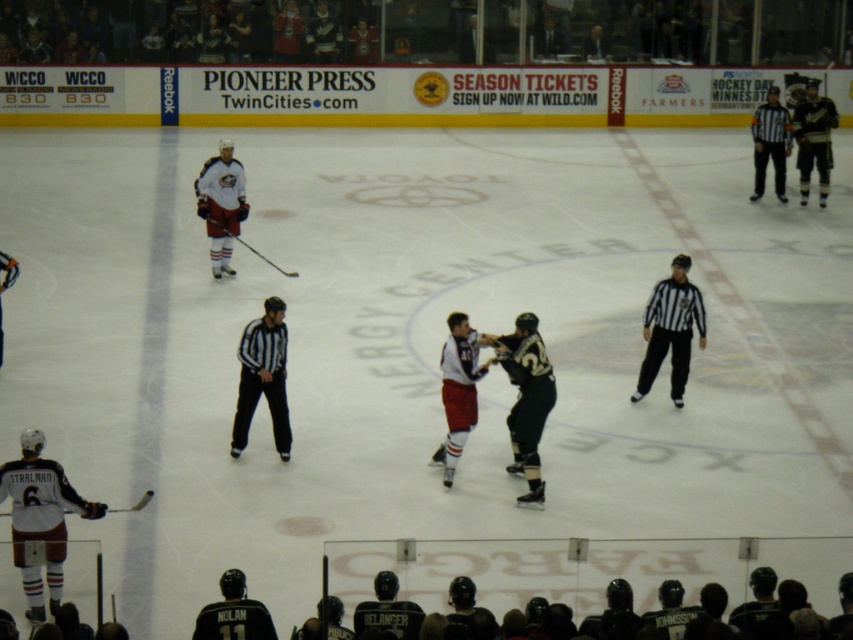
Does striped jersey official at center appear on the right side of white jersey at center?

Indeed, striped jersey official at center is positioned on the right side of white jersey at center.

Consider the image. Can you confirm if striped jersey official at center is wider than white jersey at center?

Yes.

Does point (688, 321) come behind point (460, 445)?

Yes, it is.

At what (x,y) coordinates should I click in order to perform the action: click on striped jersey official at center. Please return your answer as a coordinate pair (x, y). Looking at the image, I should click on (670, 330).

Between black striped shirt at center and white matte jersey at center, which one has more height?

white matte jersey at center is taller.

Can you confirm if black striped shirt at center is positioned to the left of white matte jersey at center?

No, black striped shirt at center is not to the left of white matte jersey at center.

Image resolution: width=853 pixels, height=640 pixels. I want to click on black striped shirt at center, so coord(263,378).

Is white jersey at center smaller than black striped shirt at upper right?

Yes, white jersey at center is smaller than black striped shirt at upper right.

Who is more distant from viewer, (462, 390) or (755, 145)?

Point (755, 145)

What do you see at coordinates (457, 388) in the screenshot? I see `white jersey at center` at bounding box center [457, 388].

I want to click on white jersey at center, so click(457, 388).